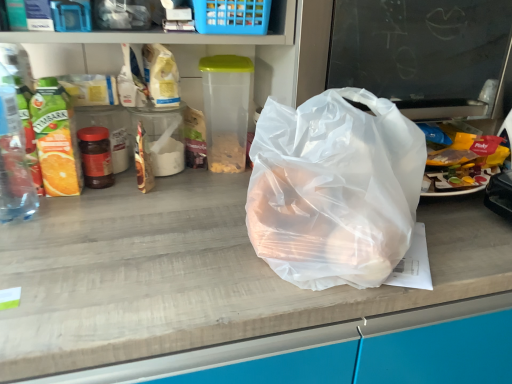
Question: Would you say transparent plastic bag at center is to the left or to the right of blue plastic basket at upper center in the picture?

Choices:
 (A) right
 (B) left

Answer: (A)

Question: From the image's perspective, relative to blue plastic basket at upper center, is transparent plastic bag at center above or below?

Choices:
 (A) below
 (B) above

Answer: (A)

Question: Considering the real-world distances, which object is closest to the clear plastic bottle at left?

Choices:
 (A) transparent plastic bag at center
 (B) blue plastic basket at upper center
 (C) transparent plastic bag at center

Answer: (B)

Question: Estimate the real-world distances between objects in this image. Which object is closer to the blue plastic basket at upper center?

Choices:
 (A) transparent plastic bag at center
 (B) transparent plastic bag at center
 (C) clear plastic bottle at left

Answer: (A)